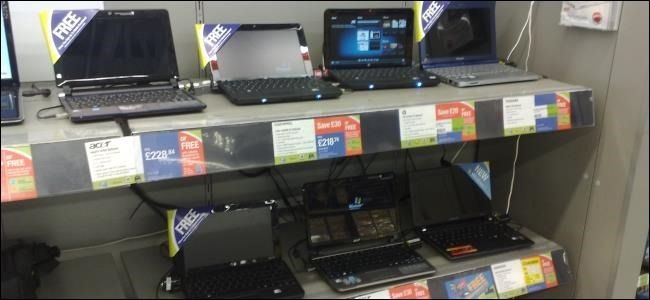
Identify the location of shelves. (225, 118), (124, 268).